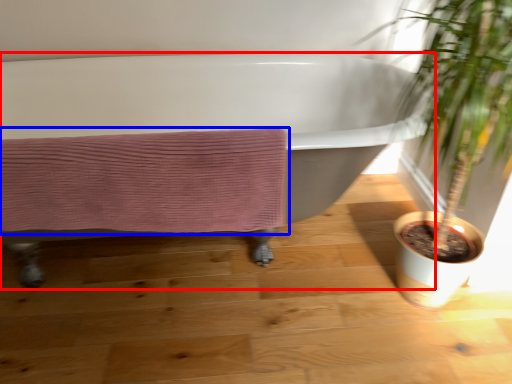
Question: Which point is closer to the camera, bathtub (highlighted by a red box) or bath towel (highlighted by a blue box)?

Choices:
 (A) bathtub
 (B) bath towel

Answer: (A)